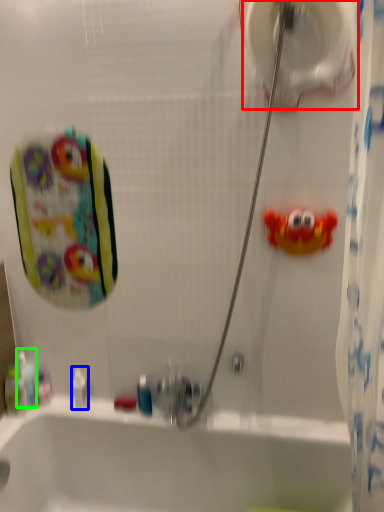
Question: Estimate the real-world distances between objects in this image. Which object is closer to toilet paper (highlighted by a red box), toiletry (highlighted by a blue box) or mouthwash (highlighted by a green box)?

Choices:
 (A) toiletry
 (B) mouthwash

Answer: (A)